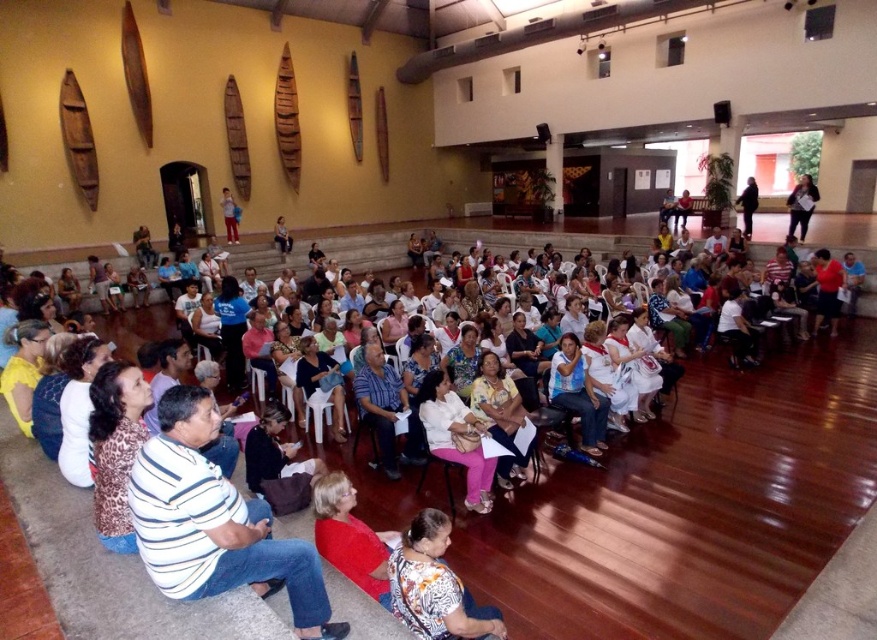
Is white fabric dress at center shorter than white cotton shirt at center?

Yes, white fabric dress at center is shorter than white cotton shirt at center.

Does white fabric dress at center have a greater width compared to white cotton shirt at center?

Indeed, white fabric dress at center has a greater width compared to white cotton shirt at center.

Locate an element on the screen. The image size is (877, 640). white fabric dress at center is located at coordinates (455, 436).

Does white fabric dress at center come in front of blue fabric chair at center?

That is True.

Can you confirm if white fabric dress at center is positioned below blue fabric chair at center?

Indeed, white fabric dress at center is positioned under blue fabric chair at center.

Between point (480, 436) and point (330, 424), which one is positioned behind?

Positioned behind is point (330, 424).

Find the location of `white fabric dress at center`. white fabric dress at center is located at coordinates [455, 436].

Locate an element on the screen. striped cotton shirt at center is located at coordinates (214, 522).

In the scene shown: Who is positioned more to the right, striped cotton shirt at center or white fabric dress at center?

white fabric dress at center

The image size is (877, 640). Identify the location of striped cotton shirt at center. (214, 522).